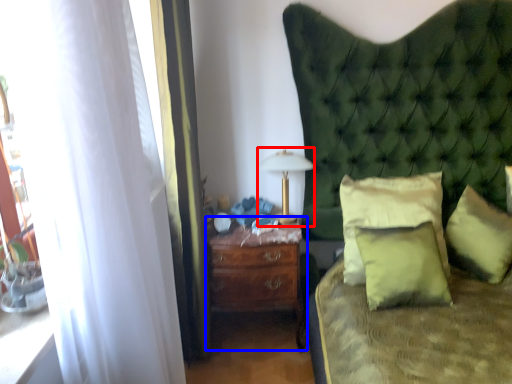
Question: Which object appears farthest to the camera in this image, bedside lamp (highlighted by a red box) or nightstand (highlighted by a blue box)?

Choices:
 (A) bedside lamp
 (B) nightstand

Answer: (A)